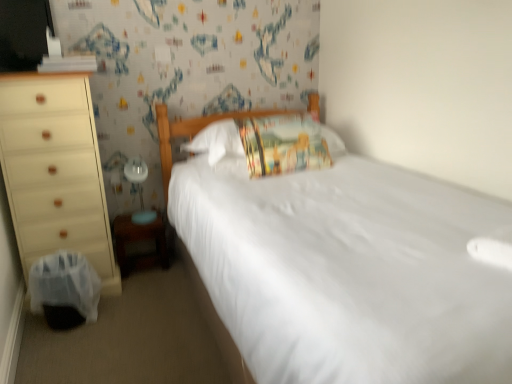
Question: Is the position of white glossy table lamp at lower left less distant than that of printed fabric pillow at center?

Choices:
 (A) no
 (B) yes

Answer: (A)

Question: From the image's perspective, is white glossy table lamp at lower left over printed fabric pillow at center?

Choices:
 (A) yes
 (B) no

Answer: (B)

Question: From a real-world perspective, is white glossy table lamp at lower left beneath printed fabric pillow at center?

Choices:
 (A) yes
 (B) no

Answer: (A)

Question: Is white glossy table lamp at lower left outside printed fabric pillow at center?

Choices:
 (A) yes
 (B) no

Answer: (A)

Question: Is white glossy table lamp at lower left in contact with printed fabric pillow at center?

Choices:
 (A) yes
 (B) no

Answer: (B)

Question: Considering the relative sizes of white glossy table lamp at lower left and printed fabric pillow at center in the image provided, is white glossy table lamp at lower left smaller than printed fabric pillow at center?

Choices:
 (A) yes
 (B) no

Answer: (A)

Question: Can you confirm if white glossy table lamp at lower left is bigger than white smooth bed at center?

Choices:
 (A) yes
 (B) no

Answer: (B)

Question: From a real-world perspective, is white glossy table lamp at lower left under white smooth bed at center?

Choices:
 (A) yes
 (B) no

Answer: (B)

Question: Can you confirm if white glossy table lamp at lower left is taller than white smooth bed at center?

Choices:
 (A) yes
 (B) no

Answer: (B)

Question: Considering the relative positions of white glossy table lamp at lower left and white smooth bed at center in the image provided, is white glossy table lamp at lower left to the right of white smooth bed at center from the viewer's perspective?

Choices:
 (A) no
 (B) yes

Answer: (A)

Question: Is white glossy table lamp at lower left positioned behind white smooth bed at center?

Choices:
 (A) no
 (B) yes

Answer: (B)

Question: Can you confirm if white glossy table lamp at lower left is wider than white smooth bed at center?

Choices:
 (A) no
 (B) yes

Answer: (A)

Question: Does wooden changing table at lower left lie behind black plastic swivel chair at lower left?

Choices:
 (A) yes
 (B) no

Answer: (A)